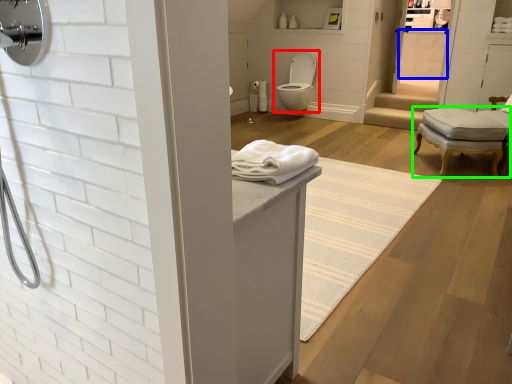
Question: Based on their relative distances, which object is farther from toilet (highlighted by a red box)? Choose from cabinetry (highlighted by a blue box) and chair (highlighted by a green box).

Choices:
 (A) cabinetry
 (B) chair

Answer: (B)